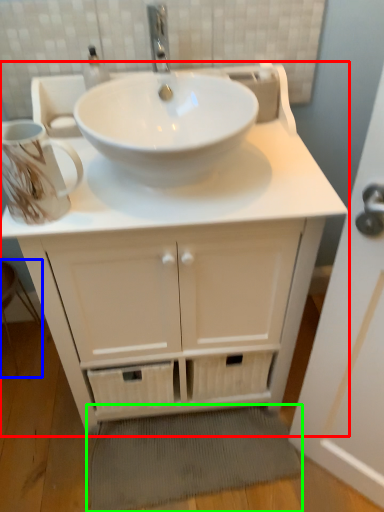
Question: Which object is the closest to the bathroom cabinet (highlighted by a red box)? Choose among these: step stool (highlighted by a blue box) or bath mat (highlighted by a green box).

Choices:
 (A) step stool
 (B) bath mat

Answer: (B)